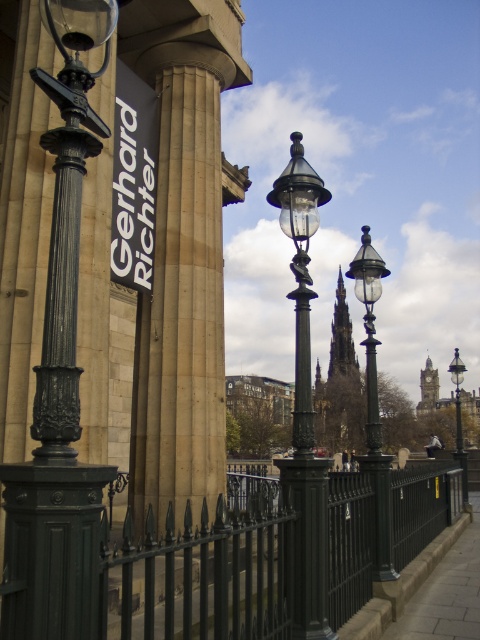
You are a city planner assessing the street layout. You need to install a new bench that must be placed between the beige stone column at center and the polished brass street light at center. Which object should the bench be closer to if it needs to align with the narrower side of the space between them?

The bench should be closer to the beige stone column at center because it has a lesser width compared to the polished brass street light at center, making the space narrower on that side.